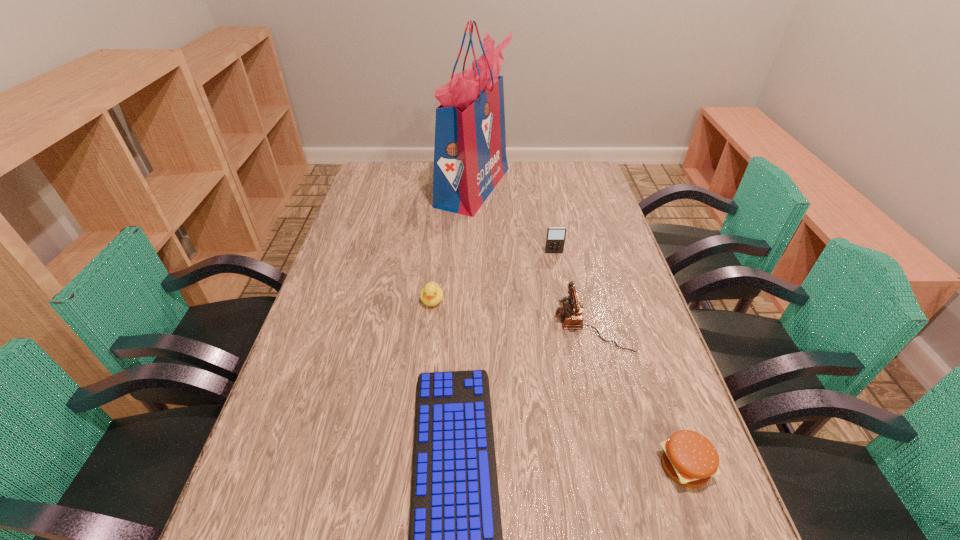
This screenshot has height=540, width=960. I want to click on vacant area situated 0.070m on the dial of the telephone, so click(529, 325).

At what (x,y) coordinates should I click in order to perform the action: click on vacant space situated 0.360m on the beak of the duckling. Please return your answer as a coordinate pair (x, y). The height and width of the screenshot is (540, 960). Looking at the image, I should click on (418, 433).

Locate an element on the screen. vacant area located on the back of the hamburger is located at coordinates (655, 379).

The width and height of the screenshot is (960, 540). I want to click on object that is at the far edge, so (x=470, y=159).

Where is `telephone that is positioned at the right edge`? telephone that is positioned at the right edge is located at coordinates (570, 313).

The width and height of the screenshot is (960, 540). What are the coordinates of `hamburger that is at the right edge` in the screenshot? It's located at (689, 458).

In order to click on vacant space at the far edge in this screenshot , I will do `click(540, 190)`.

This screenshot has height=540, width=960. I want to click on free space at the left edge, so (354, 262).

I want to click on blank space at the right edge, so click(x=590, y=258).

Identify the location of vacant area that lies between the telephone and the duckling. (512, 313).